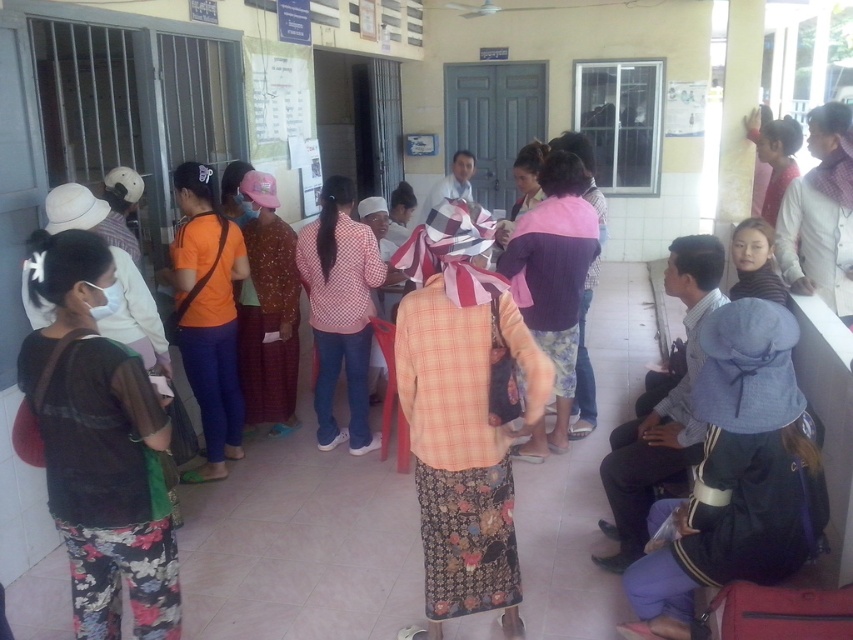
You are a visitor in this public building and need to identify the clothing items. Which clothing item is smaller in size between the blue fabric jacket at lower right and the pink checkered shirt at center?

The blue fabric jacket at lower right is smaller than the pink checkered shirt at center.

You are standing at point (x=170, y=276) and want to walk to the exit located at point (x=746, y=506). Is there a clear path directly between these two points without needing to go around any obstacles?

Yes, there is a clear path directly between point (x=170, y=276) and point (x=746, y=506) because the first point is in front of the second point, indicating no obstacles block the direct route.

From the picture: You are a visitor in this public building and need to locate the orange fabric shirt at center. Where would you look relative to the blue fabric jacket at lower right?

The orange fabric shirt at center is to the left of the blue fabric jacket at lower right.